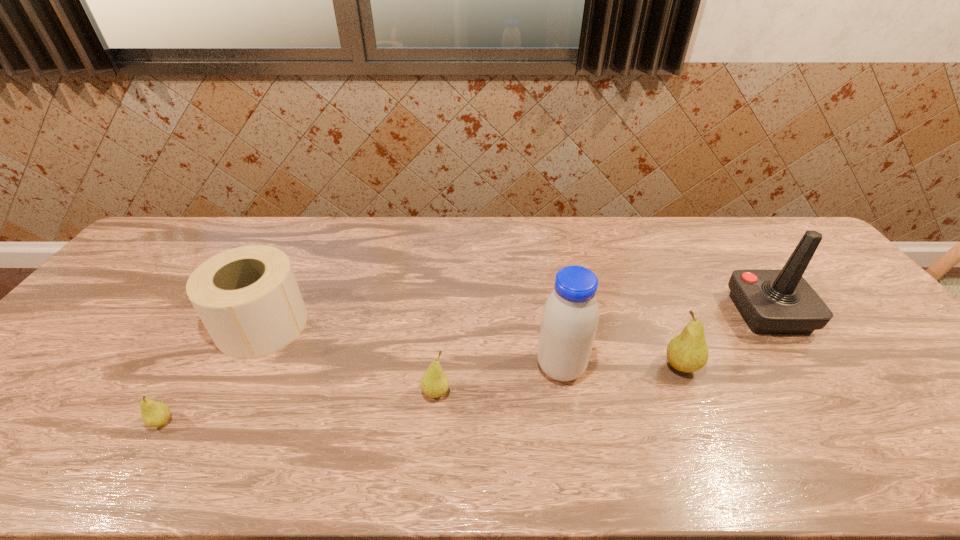
Please point a spot on the right to add another pear. Please provide its 2D coordinates. Your answer should be formatted as a tuple, i.e. [(x, y)], where the tuple contains the x and y coordinates of a point satisfying the conditions above.

[(901, 343)]